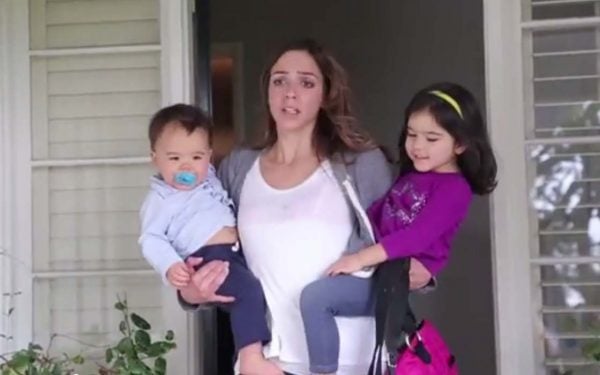
Find the location of a particular element. pacifier is located at coordinates (187, 178).